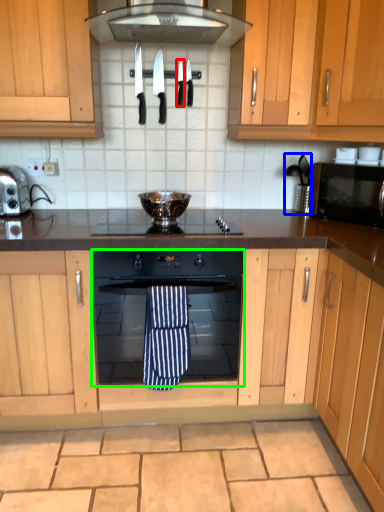
Question: Estimate the real-world distances between objects in this image. Which object is closer to knife (highlighted by a red box), coffee machine (highlighted by a blue box) or oven (highlighted by a green box)?

Choices:
 (A) coffee machine
 (B) oven

Answer: (A)